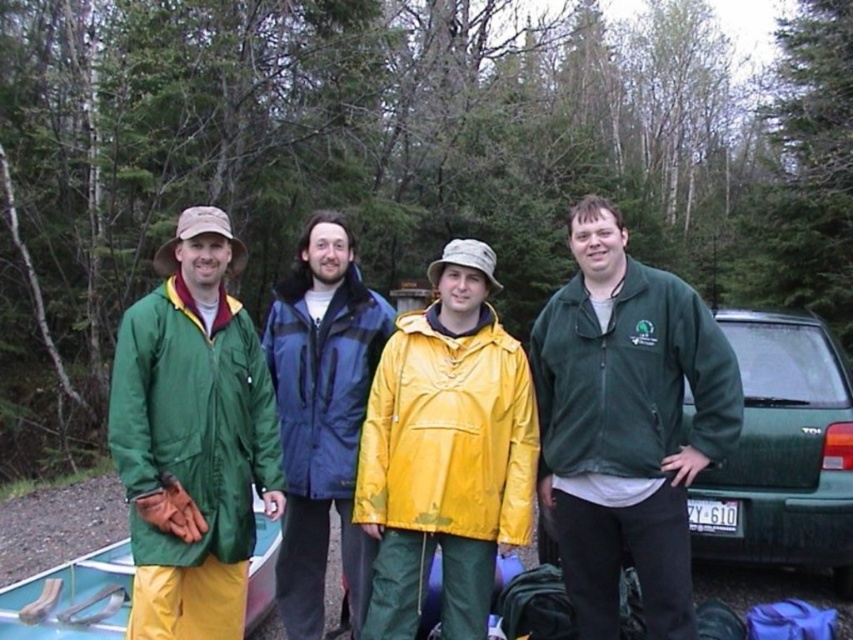
You are a photographer standing in front of the four people in the forest. You want to take a photo where both point (x=566, y=554) and point (x=172, y=320) are clearly visible. Which point is closer to the camera so that it won not be obscured by the other?

Point (x=172, y=320) is closer to the camera than point (x=566, y=554), so it will not be obscured by the latter. Therefore, ensure both points are in frame such that the closer point (x=172, y=320) is not blocking the further point (x=566, y=554).

You are taking a photo of the scene and want to focus on both point (711, 552) and point (41, 602). Which point should you focus on first to ensure both are in sharp focus?

You should focus on point (711, 552) first because it is closer to the camera than point (41, 602), ensuring both will be in focus when using depth of field.